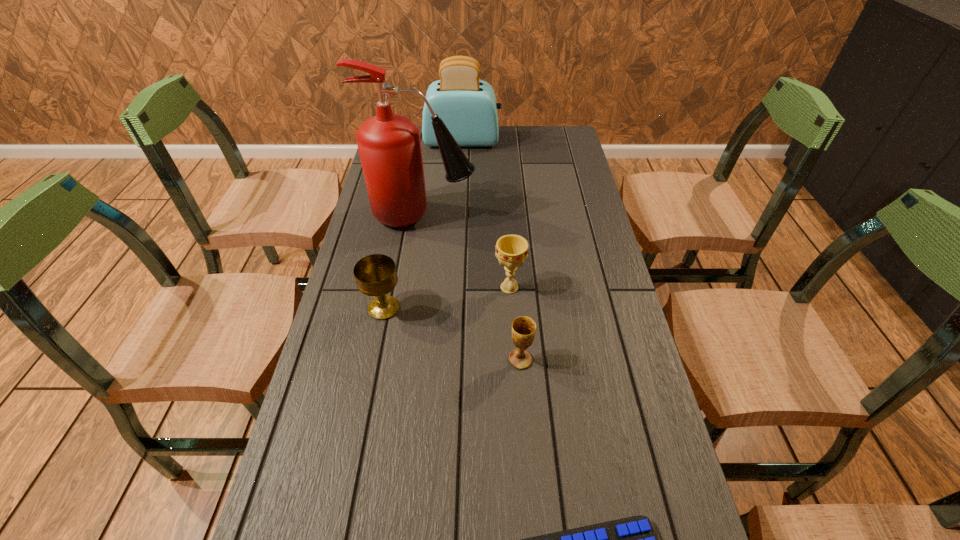
At what (x,y) coordinates should I click in order to perform the action: click on the tallest object. Please return your answer as a coordinate pair (x, y). This screenshot has height=540, width=960. Looking at the image, I should click on (389, 145).

Where is `the second farthest object`? The height and width of the screenshot is (540, 960). the second farthest object is located at coordinates (389, 145).

Where is `the farthest object`? This screenshot has width=960, height=540. the farthest object is located at coordinates (467, 106).

At what (x,y) coordinates should I click in order to perform the action: click on toaster. Please return your answer as a coordinate pair (x, y). This screenshot has height=540, width=960. Looking at the image, I should click on (467, 106).

Where is `the leftmost chalice`? the leftmost chalice is located at coordinates (375, 275).

At what (x,y) coordinates should I click in order to perform the action: click on the second nearest object. Please return your answer as a coordinate pair (x, y). The height and width of the screenshot is (540, 960). Looking at the image, I should click on (523, 328).

The width and height of the screenshot is (960, 540). Identify the location of vacant space located with the nozzle aimed from the second farthest object. (575, 215).

Image resolution: width=960 pixels, height=540 pixels. Identify the location of vacant region located 0.220m on the side of the farthest object with the lever. (556, 141).

Image resolution: width=960 pixels, height=540 pixels. What are the coordinates of `free space located 0.060m on the front of the leftmost chalice` in the screenshot? It's located at (377, 343).

The height and width of the screenshot is (540, 960). What are the coordinates of `vacant space located on the back of the fifth farthest object` in the screenshot? It's located at (514, 273).